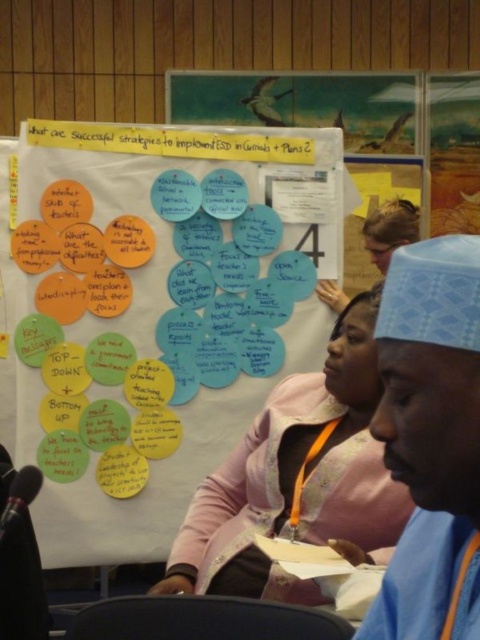
Who is higher up, yellow paper circles at upper center or wooden frame at upper right?

wooden frame at upper right

What do you see at coordinates (158, 310) in the screenshot?
I see `yellow paper circles at upper center` at bounding box center [158, 310].

Between point (239, 262) and point (463, 90), which one is positioned behind?

Positioned behind is point (463, 90).

You are a GUI agent. You are given a task and a screenshot of the screen. Output one action in this format:
    pyautogui.click(x=<x>, y=<y>)
    Task: Click on the yellow paper circles at upper center
    The width and height of the screenshot is (480, 640).
    Given the screenshot: What is the action you would take?
    pyautogui.click(x=158, y=310)

Consider the image. Can you confirm if yellow paper circles at upper center is positioned above pink fabric jacket at center?

Correct, yellow paper circles at upper center is located above pink fabric jacket at center.

Which is behind, point (31, 186) or point (291, 593)?

Point (31, 186)

Where is `yellow paper circles at upper center`? This screenshot has height=640, width=480. yellow paper circles at upper center is located at coordinates (158, 310).

Who is positioned more to the right, yellow paper circles at upper center or white paper poster at upper center?

From the viewer's perspective, white paper poster at upper center appears more on the right side.

Identify the location of yellow paper circles at upper center. (158, 310).

Find the location of a particular element. The width and height of the screenshot is (480, 640). yellow paper circles at upper center is located at coordinates (158, 310).